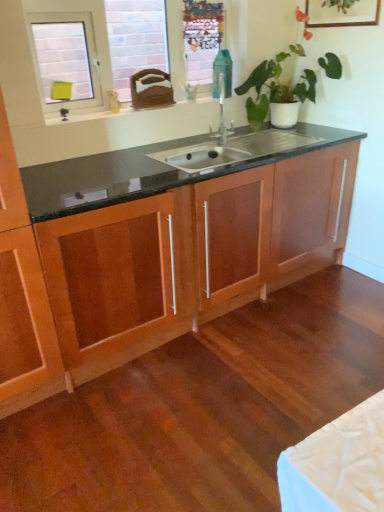
Question: From a real-world perspective, is metallic mesh at upper center over green glossy plant at upper center?

Choices:
 (A) yes
 (B) no

Answer: (A)

Question: Can you confirm if metallic mesh at upper center is positioned to the left of green glossy plant at upper center?

Choices:
 (A) yes
 (B) no

Answer: (A)

Question: Is metallic mesh at upper center thinner than green glossy plant at upper center?

Choices:
 (A) no
 (B) yes

Answer: (B)

Question: Does metallic mesh at upper center come in front of green glossy plant at upper center?

Choices:
 (A) yes
 (B) no

Answer: (B)

Question: Can you confirm if metallic mesh at upper center is smaller than green glossy plant at upper center?

Choices:
 (A) no
 (B) yes

Answer: (B)

Question: Is point (119, 111) positioned closer to the camera than point (337, 75)?

Choices:
 (A) closer
 (B) farther

Answer: (A)

Question: Considering the positions of white glossy window sill at upper left and green glossy plant at upper center in the image, is white glossy window sill at upper left wider or thinner than green glossy plant at upper center?

Choices:
 (A) wide
 (B) thin

Answer: (B)

Question: Considering the relative positions of white glossy window sill at upper left and green glossy plant at upper center in the image provided, is white glossy window sill at upper left to the left or to the right of green glossy plant at upper center?

Choices:
 (A) right
 (B) left

Answer: (B)

Question: Considering their positions, is white glossy window sill at upper left located in front of or behind green glossy plant at upper center?

Choices:
 (A) behind
 (B) front

Answer: (A)

Question: Is wooden cabinet at center bigger or smaller than white glossy window at upper left?

Choices:
 (A) big
 (B) small

Answer: (A)

Question: Considering the positions of point (66, 347) and point (34, 9), is point (66, 347) closer or farther from the camera than point (34, 9)?

Choices:
 (A) farther
 (B) closer

Answer: (B)

Question: Is wooden cabinet at center inside the boundaries of white glossy window at upper left, or outside?

Choices:
 (A) outside
 (B) inside

Answer: (A)

Question: Considering the relative positions of wooden cabinet at center and white glossy window at upper left in the image provided, is wooden cabinet at center to the left or to the right of white glossy window at upper left?

Choices:
 (A) right
 (B) left

Answer: (A)

Question: Looking at their shapes, would you say wooden cabinet at center is wider or thinner than metallic mesh at upper center?

Choices:
 (A) wide
 (B) thin

Answer: (A)

Question: In the image, is wooden cabinet at center on the left side or the right side of metallic mesh at upper center?

Choices:
 (A) right
 (B) left

Answer: (B)